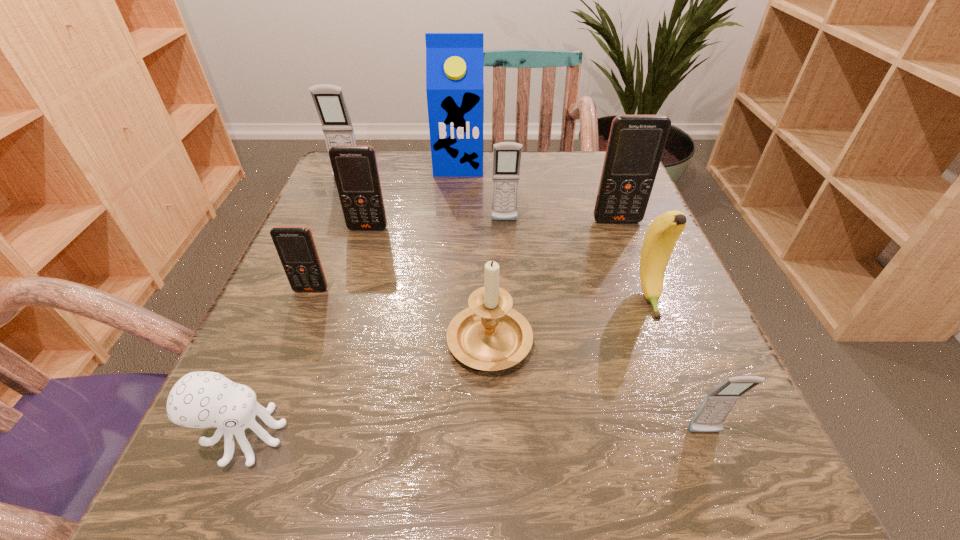
The image size is (960, 540). I want to click on object that is positioned at the near edge, so click(203, 399).

Find the location of `octopus at the left edge`. octopus at the left edge is located at coordinates (203, 399).

Image resolution: width=960 pixels, height=540 pixels. In order to click on banana that is at the right edge in this screenshot , I will do `click(661, 237)`.

At what (x,y) coordinates should I click in order to perform the action: click on object positioned at the far left corner. Please return your answer as a coordinate pair (x, y). The height and width of the screenshot is (540, 960). Looking at the image, I should click on (329, 100).

Find the location of `object that is at the near left corner`. object that is at the near left corner is located at coordinates (203, 399).

Image resolution: width=960 pixels, height=540 pixels. I want to click on vacant area at the far edge, so click(x=435, y=180).

Locate an element on the screen. vacant space at the near edge of the desktop is located at coordinates (553, 516).

In the image, there is a desktop. Identify the location of vacant space at the left edge. (323, 308).

Identify the location of vacant space at the far right corner of the desktop. (568, 159).

Where is `vacant region at the near right corner of the desktop`? vacant region at the near right corner of the desktop is located at coordinates (760, 488).